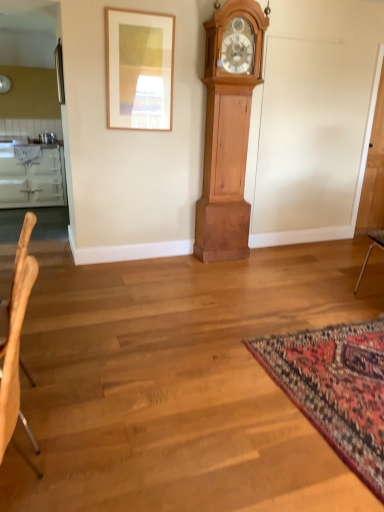
Locate an element on the screen. The image size is (384, 512). free space behind light brown wood chair at left is located at coordinates (90, 455).